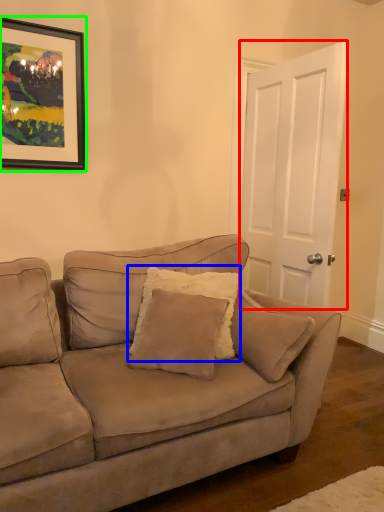
Question: Considering the real-world distances, which object is farthest from door (highlighted by a red box)? pillow (highlighted by a blue box) or picture frame (highlighted by a green box)?

Choices:
 (A) pillow
 (B) picture frame

Answer: (B)